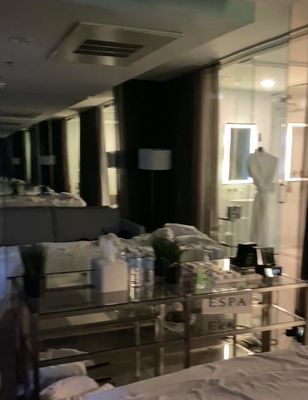
Where is `the back of a sofa`? Image resolution: width=308 pixels, height=400 pixels. the back of a sofa is located at coordinates (66, 236), (25, 228).